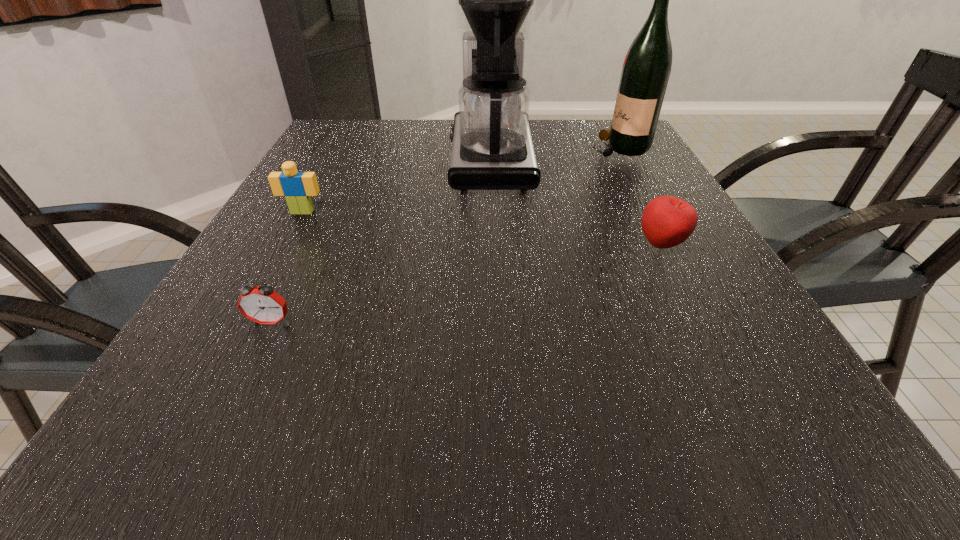
Locate an element on the screen. This screenshot has width=960, height=540. wine bottle is located at coordinates (646, 69).

Find the location of a particular element. coffee maker is located at coordinates (492, 149).

Locate an element on the screen. the third farthest object is located at coordinates (297, 187).

You are a GUI agent. You are given a task and a screenshot of the screen. Output one action in this format:
    pyautogui.click(x=<x>, y=<y>)
    Task: Click on the second nearest object
    
    Given the screenshot: What is the action you would take?
    pyautogui.click(x=667, y=221)

Where is `the shortest object`? This screenshot has height=540, width=960. the shortest object is located at coordinates (262, 305).

I want to click on the nearest object, so click(262, 305).

Where is `vacant space located 0.250m on the left of the wine bottle`? The image size is (960, 540). vacant space located 0.250m on the left of the wine bottle is located at coordinates (498, 147).

At what (x,y) coordinates should I click in order to perform the action: click on vacant space situated 0.180m at the front of the third object from left to right where the controls are located. Please return your answer as a coordinate pair (x, y). The height and width of the screenshot is (540, 960). Looking at the image, I should click on (380, 159).

You are a GUI agent. You are given a task and a screenshot of the screen. Output one action in this format:
    pyautogui.click(x=<x>, y=<y>)
    Task: Click on the vacant space situated 0.090m at the front of the third object from left to right where the controls are located
    
    Given the screenshot: What is the action you would take?
    (x=415, y=159)

You are a GUI agent. You are given a task and a screenshot of the screen. Output one action in this format:
    pyautogui.click(x=<x>, y=<y>)
    Task: Click on the free space located 0.300m at the front of the third object from left to right where the controls are located
    The height and width of the screenshot is (540, 960).
    Given the screenshot: What is the action you would take?
    pyautogui.click(x=335, y=159)